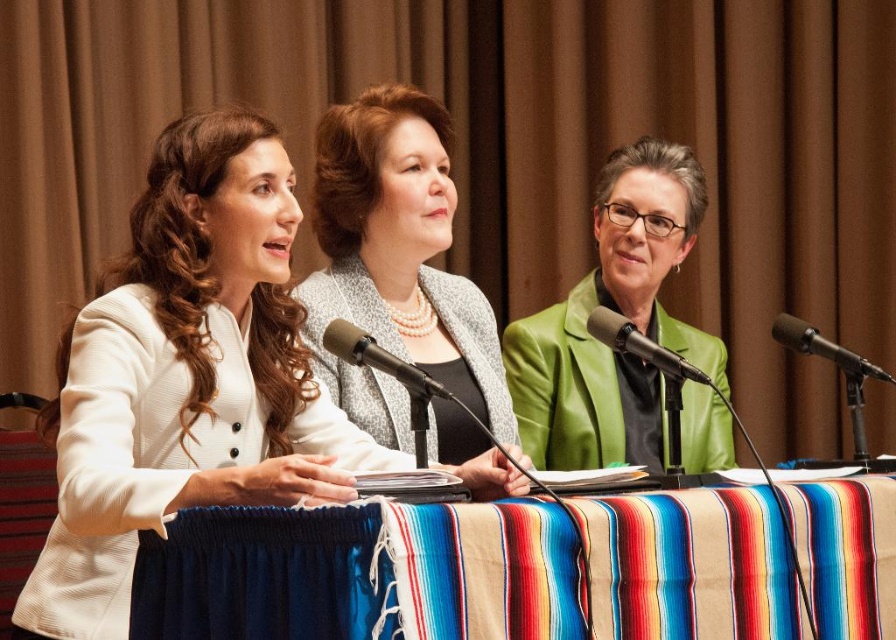
Question: Is striped fabric tablecloth at center to the left of matte gray blazer at center from the viewer's perspective?

Choices:
 (A) yes
 (B) no

Answer: (B)

Question: Which point is closer to the camera taking this photo?

Choices:
 (A) (255, 513)
 (B) (832, 340)
 (C) (636, 196)

Answer: (A)

Question: Is metallic silver microphone at center smaller than metallic green microphone at center?

Choices:
 (A) yes
 (B) no

Answer: (A)

Question: Among these objects, which one is farthest from the camera?

Choices:
 (A) metallic silver microphone at center
 (B) metallic green microphone at center
 (C) green leather jacket at center

Answer: (C)

Question: Which object is closer to the camera taking this photo?

Choices:
 (A) metallic silver microphone at center
 (B) striped fabric tablecloth at center
 (C) white textured blazer at left
 (D) metallic green microphone at center

Answer: (B)

Question: Where is green leather jacket at center located in relation to metallic silver microphone at right in the image?

Choices:
 (A) below
 (B) above

Answer: (B)